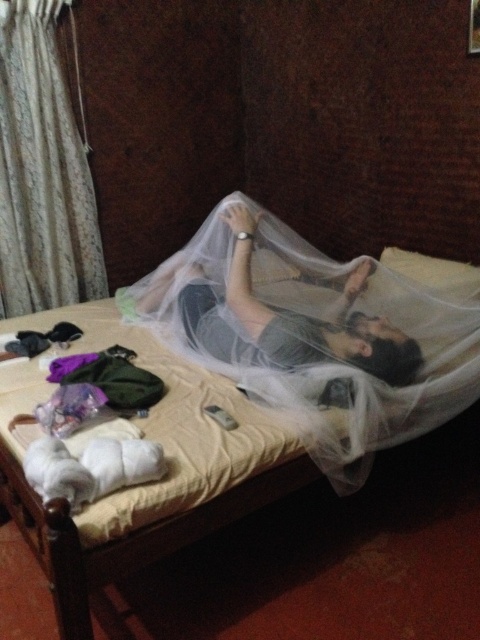
You are a nurse checking on a patient in a hospital room. You see the white mesh mosquito net at upper center and the matte gray fabric at center. Which object is higher up in the bed area?

The white mesh mosquito net at upper center is taller than the matte gray fabric at center, so the white mesh mosquito net at upper center is higher up in the bed area.

In the scene shown: You are a delivery robot with a package that needs to be placed between the white mesh mosquito net at upper center and the white textured curtain at upper left. The package measures 4 feet in length. Can you fit the package between them without bending it?

The distance between the white mesh mosquito net at upper center and the white textured curtain at upper left is 3.82 feet. Since the package is 4 feet long, which is longer than the available space, it cannot be placed straight between them without bending.

Based on the photo, you are a nurse checking on a patient in a hospital room. You see the white mesh mosquito net at upper center and the matte gray fabric at center. Which object is nearer to you?

The white mesh mosquito net at upper center is closer to the viewer than the matte gray fabric at center.